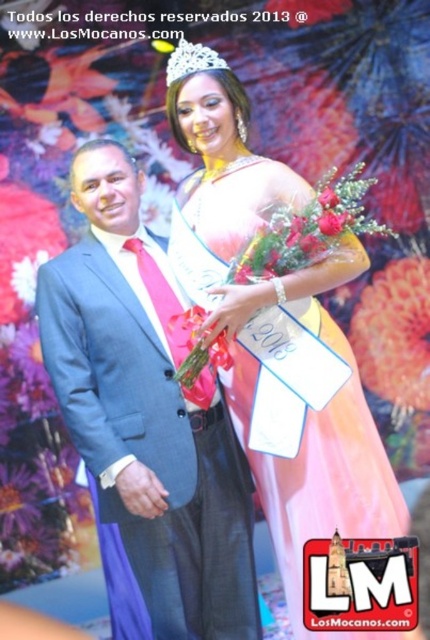
You are a photographer positioned at the back of the stage. You need to capture a photo where both the blue suit at center and the clear crystal tiara at upper center are in focus. The camera you are using has a depth of field that can cover 4 feet. Will you be able to achieve this?

The distance between the blue suit at center and the clear crystal tiara at upper center is 3.75 feet, which is within the camera s 4 feet depth of field. Yes, you can capture both in focus.

You are a photographer standing behind the camera. You want to capture a photo of both the man in dark gray suit and the woman in blue suit at center. The minimum distance required for your camera to focus on both subjects clearly is 6 feet. Will you be able to do so?

The man in dark gray suit and the woman in blue suit at center are 6.48 feet apart. Since the minimum distance required is 6 feet, the camera can focus on both subjects clearly as the distance between them meets the requirement.

You are a photographer at the event and want to ensure both the blue suit at center and the clear crystal tiara at upper center are in focus. Which object should you adjust your camera focus to first to account for their size difference?

The blue suit at center is much taller than the clear crystal tiara at upper center, so you should focus on the blue suit at center first since it is larger and requires more precise focus.